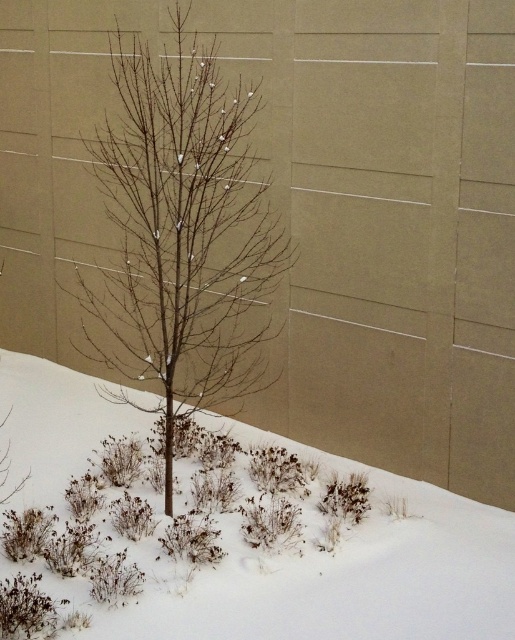
Question: Where is white fluffy snow at center located in relation to bare branches at center in the image?

Choices:
 (A) below
 (B) above

Answer: (A)

Question: Observing the image, what is the correct spatial positioning of white fluffy snow at center in reference to bare branches at center?

Choices:
 (A) above
 (B) below

Answer: (B)

Question: Is white fluffy snow at center below bare branches at center?

Choices:
 (A) yes
 (B) no

Answer: (A)

Question: Which object is closer to the camera taking this photo?

Choices:
 (A) bare branches at center
 (B) white fluffy snow at center

Answer: (B)

Question: Among these objects, which one is nearest to the camera?

Choices:
 (A) white fluffy snow at center
 (B) bare branches at center

Answer: (A)